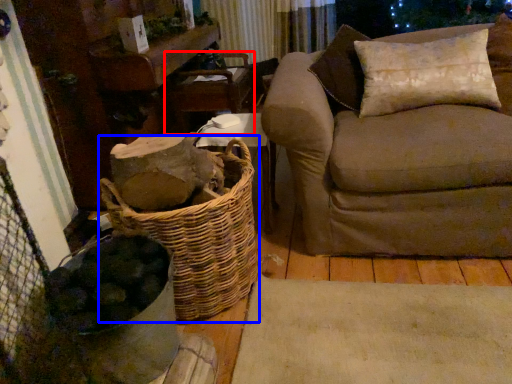
Question: Among these objects, which one is nearest to the camera, armchair (highlighted by a red box) or basket (highlighted by a blue box)?

Choices:
 (A) armchair
 (B) basket

Answer: (B)